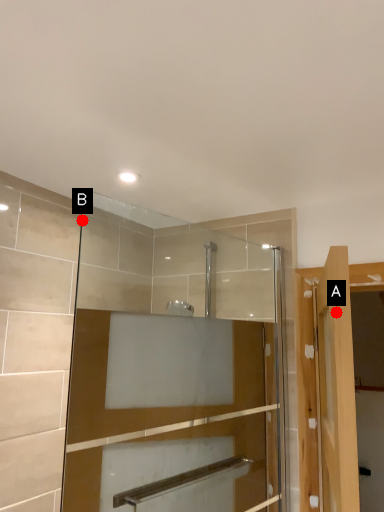
Question: Two points are circled on the image, labeled by A and B beside each circle. Which point is further to the camera?

Choices:
 (A) A is further
 (B) B is further

Answer: (B)